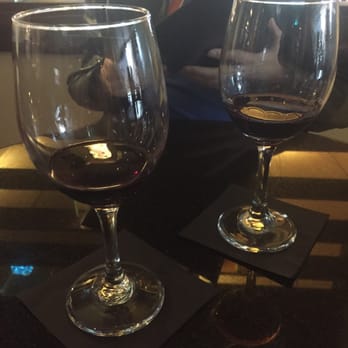
Identify the location of round wooden table. This screenshot has width=348, height=348. (309, 175).